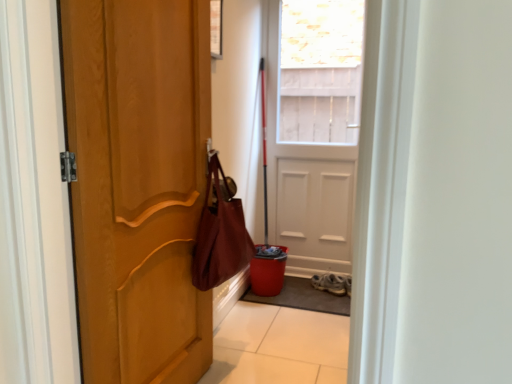
Where is `free spot below white leather sneakers at lower center (from a real-world perspective)`? The width and height of the screenshot is (512, 384). free spot below white leather sneakers at lower center (from a real-world perspective) is located at coordinates (332, 288).